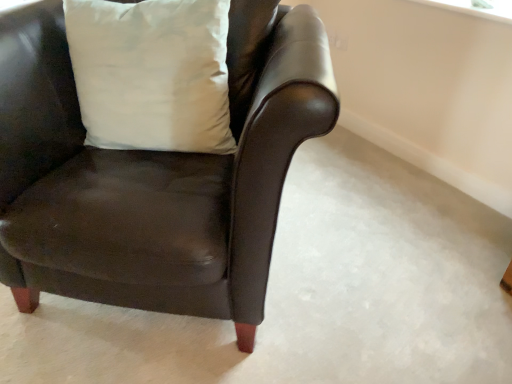
In order to click on vacant area that lies to the right of matte black armchair at center in this screenshot , I will do `click(388, 249)`.